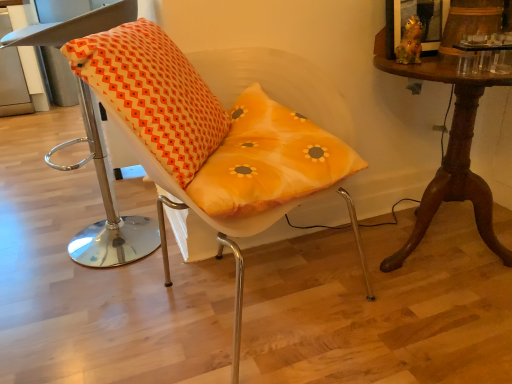
Question: Considering the relative sizes of mahogany wood table at right and translucent orange cushion at center, the first chair in the right-to-left sequence, in the image provided, is mahogany wood table at right bigger than translucent orange cushion at center, the first chair in the right-to-left sequence,?

Choices:
 (A) no
 (B) yes

Answer: (A)

Question: Can you confirm if mahogany wood table at right is thinner than translucent orange cushion at center, the second chair when ordered from left to right?

Choices:
 (A) yes
 (B) no

Answer: (A)

Question: Is mahogany wood table at right completely or partially outside of translucent orange cushion at center, the second chair when ordered from left to right?

Choices:
 (A) yes
 (B) no

Answer: (A)

Question: Considering the relative sizes of mahogany wood table at right and translucent orange cushion at center, the first chair in the right-to-left sequence, in the image provided, is mahogany wood table at right wider than translucent orange cushion at center, the first chair in the right-to-left sequence,?

Choices:
 (A) yes
 (B) no

Answer: (B)

Question: Is mahogany wood table at right taller than translucent orange cushion at center, the first chair in the right-to-left sequence?

Choices:
 (A) yes
 (B) no

Answer: (B)

Question: From the image's perspective, is mahogany wood table at right located above or below orange printed cushion at left?

Choices:
 (A) above
 (B) below

Answer: (B)

Question: Does point (476, 198) appear closer or farther from the camera than point (185, 162)?

Choices:
 (A) farther
 (B) closer

Answer: (A)

Question: Is mahogany wood table at right to the left or to the right of orange printed cushion at left in the image?

Choices:
 (A) right
 (B) left

Answer: (A)

Question: Considering the positions of mahogany wood table at right and orange printed cushion at left in the image, is mahogany wood table at right wider or thinner than orange printed cushion at left?

Choices:
 (A) thin
 (B) wide

Answer: (B)

Question: From a real-world perspective, is orange printed cushion at left above or below orange fabric cushion at left, which is the first chair from left to right?

Choices:
 (A) below
 (B) above

Answer: (B)

Question: From the image's perspective, relative to orange fabric cushion at left, the second chair viewed from the right, is orange printed cushion at left above or below?

Choices:
 (A) above
 (B) below

Answer: (A)

Question: Based on their sizes in the image, would you say orange printed cushion at left is bigger or smaller than orange fabric cushion at left, the second chair viewed from the right?

Choices:
 (A) small
 (B) big

Answer: (A)

Question: In the image, is orange printed cushion at left positioned in front of or behind orange fabric cushion at left, which is the first chair from left to right?

Choices:
 (A) front
 (B) behind

Answer: (A)

Question: Is orange fabric cushion at left, the second chair viewed from the right, bigger or smaller than translucent orange cushion at center, the first chair in the right-to-left sequence?

Choices:
 (A) small
 (B) big

Answer: (A)

Question: Does point (35, 36) appear closer or farther from the camera than point (348, 150)?

Choices:
 (A) farther
 (B) closer

Answer: (A)